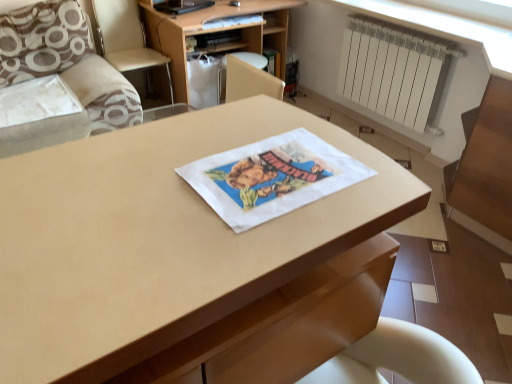
Question: From the image's perspective, is white matte radiator at upper right below matte wood desk at center?

Choices:
 (A) yes
 (B) no

Answer: (B)

Question: Is white matte radiator at upper right in front of matte wood desk at center?

Choices:
 (A) no
 (B) yes

Answer: (A)

Question: Is the position of white matte radiator at upper right more distant than that of matte wood desk at center?

Choices:
 (A) no
 (B) yes

Answer: (B)

Question: Is white matte radiator at upper right located outside matte wood desk at center?

Choices:
 (A) yes
 (B) no

Answer: (A)

Question: Is white matte radiator at upper right beside matte wood desk at center?

Choices:
 (A) yes
 (B) no

Answer: (B)

Question: Is white matte radiator at upper right shorter than matte wood desk at center?

Choices:
 (A) yes
 (B) no

Answer: (A)

Question: Is brown textured pillow at upper left aimed at beige fabric armchair at left?

Choices:
 (A) no
 (B) yes

Answer: (A)

Question: Is brown textured pillow at upper left to the right of beige fabric armchair at left from the viewer's perspective?

Choices:
 (A) no
 (B) yes

Answer: (A)

Question: Considering the relative sizes of brown textured pillow at upper left and beige fabric armchair at left in the image provided, is brown textured pillow at upper left bigger than beige fabric armchair at left?

Choices:
 (A) no
 (B) yes

Answer: (A)

Question: Is the position of brown textured pillow at upper left more distant than that of beige fabric armchair at left?

Choices:
 (A) yes
 (B) no

Answer: (B)

Question: Would you say brown textured pillow at upper left contains beige fabric armchair at left?

Choices:
 (A) yes
 (B) no

Answer: (B)

Question: From a real-world perspective, does brown textured pillow at upper left sit lower than beige fabric armchair at left?

Choices:
 (A) yes
 (B) no

Answer: (B)

Question: Considering the relative sizes of brown textured pillow at upper left and white matte radiator at upper right in the image provided, is brown textured pillow at upper left thinner than white matte radiator at upper right?

Choices:
 (A) yes
 (B) no

Answer: (B)